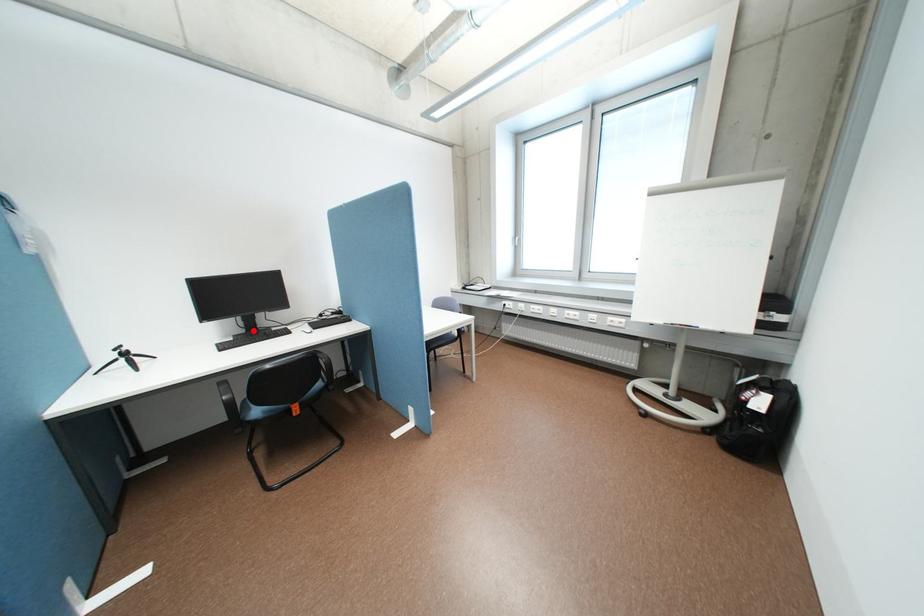
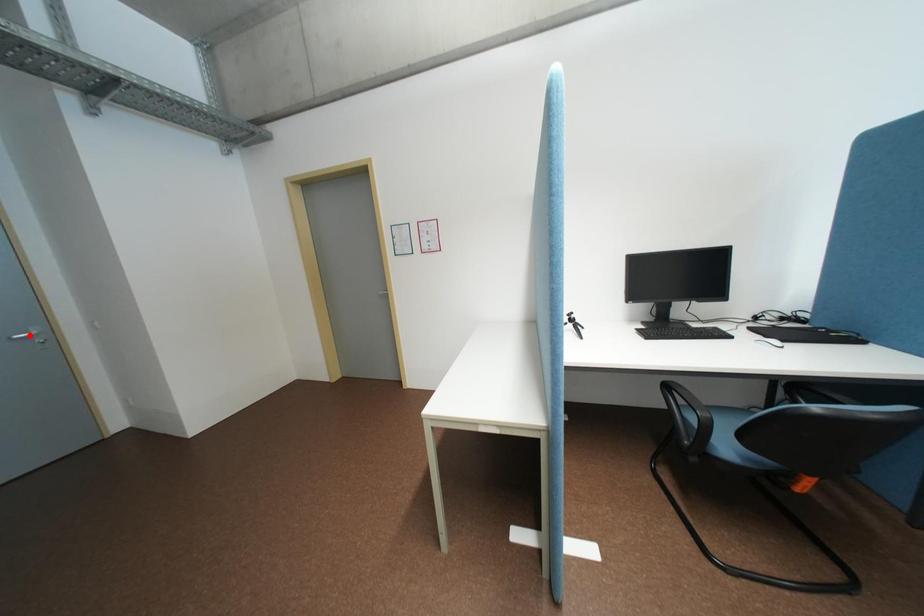
I am providing you with two images of the same scene from different viewpoints. A red point is marked on the first image and another point is marked on the second image. Does the point marked in image1 correspond to the same location as the one in image2?

No